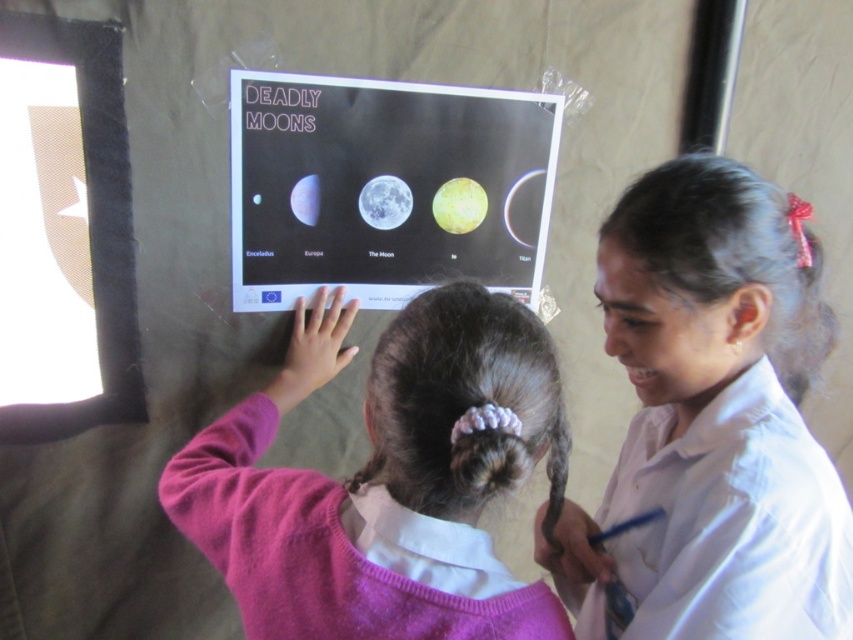
Question: Which point appears closest to the camera in this image?

Choices:
 (A) (471, 204)
 (B) (283, 300)
 (C) (718, 538)
 (D) (560, 474)

Answer: (C)

Question: Based on their relative distances, which object is nearer to the smooth yellowish-green sphere at center?

Choices:
 (A) matte paper poster at upper center
 (B) white shirt at upper right
 (C) pink sweater at upper center

Answer: (A)

Question: Is white shirt at upper right further to the viewer compared to matte paper poster at upper center?

Choices:
 (A) yes
 (B) no

Answer: (B)

Question: Estimate the real-world distances between objects in this image. Which object is closer to the white shirt at upper right?

Choices:
 (A) pink sweater at upper center
 (B) matte paper poster at upper center

Answer: (A)

Question: Is pink sweater at upper center to the right of matte paper poster at upper center from the viewer's perspective?

Choices:
 (A) no
 (B) yes

Answer: (B)

Question: Observing the image, what is the correct spatial positioning of white shirt at upper right in reference to smooth yellowish-green sphere at center?

Choices:
 (A) right
 (B) left

Answer: (A)